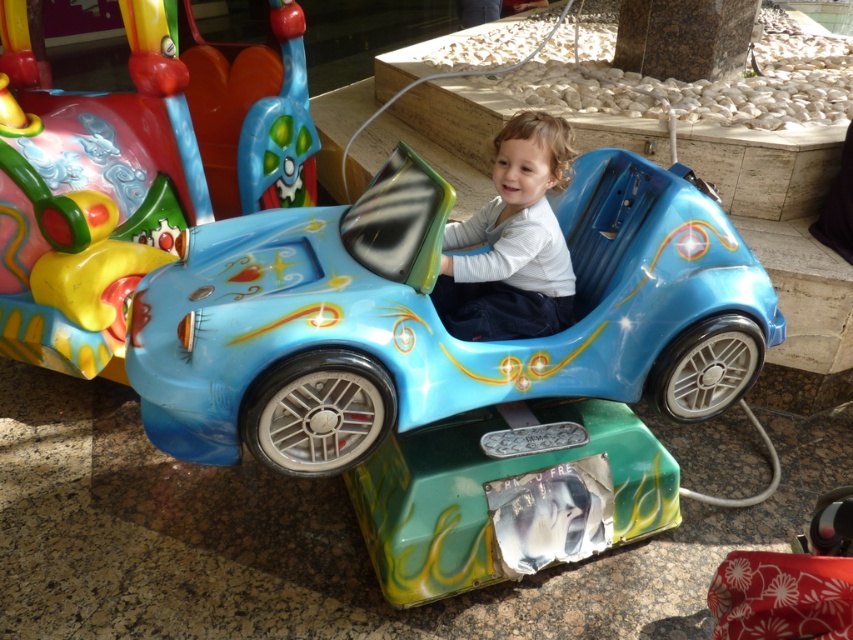
Looking at this image, you are a parent trying to decide which car to let your child play with. The shiny plastic toy car at center and the glossy plastic car at center are both available. Based on their sizes, which one might be more suitable for a child to hold comfortably?

The shiny plastic toy car at center has a greater width than the glossy plastic car at center, so it might be more suitable for a child to hold comfortably due to its larger size.

You are a parent trying to decide if your child can safely sit in the matte blue car seat at center while holding the shiny plastic toy car at center. Based on their sizes, will the child have enough space?

The shiny plastic toy car at center is wider than the matte blue car seat at center, so there might not be enough space for the child to hold the toy while sitting safely in the seat.